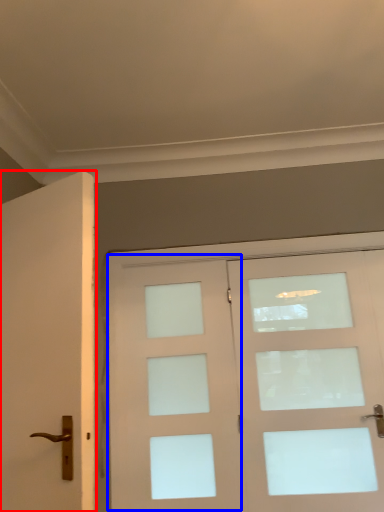
Question: Among these objects, which one is farthest to the camera, door (highlighted by a red box) or screen door (highlighted by a blue box)?

Choices:
 (A) door
 (B) screen door

Answer: (B)